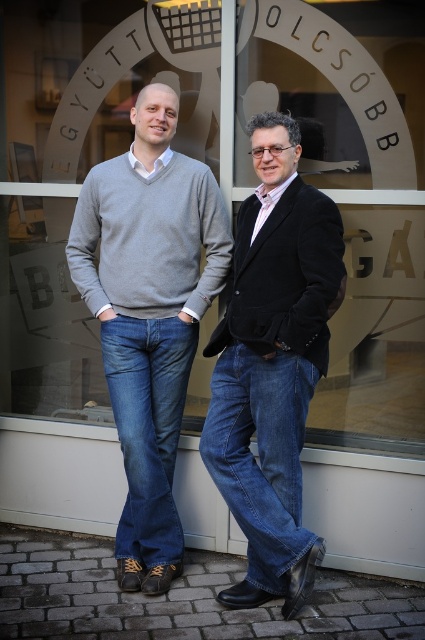
Question: Does transparent glass shop window at center come in front of black velvet blazer at center?

Choices:
 (A) yes
 (B) no

Answer: (B)

Question: Which object is positioned closest to the black velvet blazer at center?

Choices:
 (A) denim jeans at center
 (B) transparent glass shop window at center

Answer: (A)

Question: Which point is closer to the camera?

Choices:
 (A) (305, 358)
 (B) (257, 369)

Answer: (A)

Question: Is transparent glass shop window at center positioned behind black velvet blazer at center?

Choices:
 (A) yes
 (B) no

Answer: (A)

Question: Which object is the farthest from the transparent glass shop window at center?

Choices:
 (A) denim jeans at center
 (B) black velvet blazer at center

Answer: (B)

Question: Does transparent glass shop window at center appear on the right side of black velvet blazer at center?

Choices:
 (A) yes
 (B) no

Answer: (B)